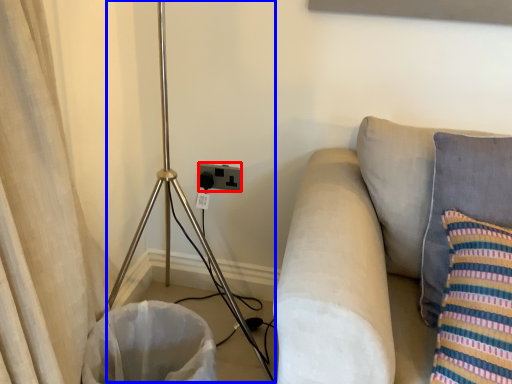
Question: Which of the following is the farthest to the observer, electric outlet (highlighted by a red box) or tripod (highlighted by a blue box)?

Choices:
 (A) electric outlet
 (B) tripod

Answer: (A)